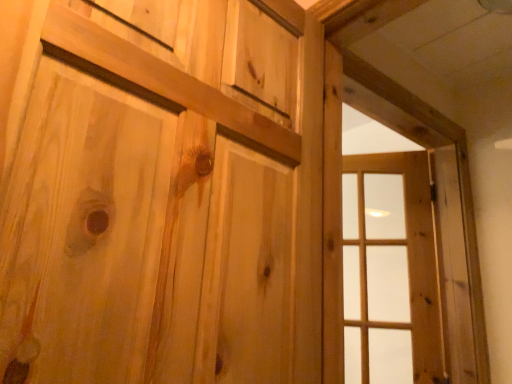
Question: From the image's perspective, is natural wood window frame at right positioned above or below clear glass window at right?

Choices:
 (A) below
 (B) above

Answer: (B)

Question: Based on their sizes in the image, would you say natural wood window frame at right is bigger or smaller than clear glass window at right?

Choices:
 (A) big
 (B) small

Answer: (A)

Question: Estimate the real-world distances between objects in this image. Which object is closer to the natural wood window frame at right?

Choices:
 (A) natural wood door at center
 (B) clear glass window at right

Answer: (B)

Question: Based on their relative distances, which object is farther from the natural wood door at center?

Choices:
 (A) clear glass window at right
 (B) natural wood window frame at right

Answer: (A)